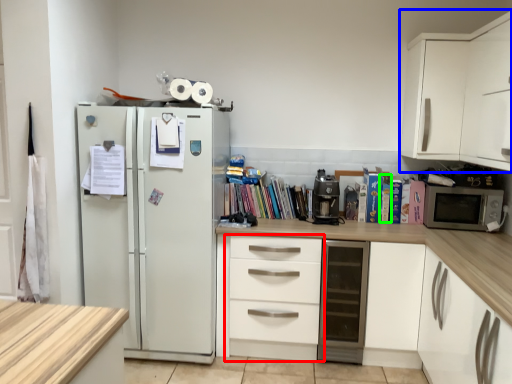
Question: Which object is the farthest from chest of drawers (highlighted by a red box)? Choose among these: cabinetry (highlighted by a blue box) or paperback book (highlighted by a green box).

Choices:
 (A) cabinetry
 (B) paperback book

Answer: (A)